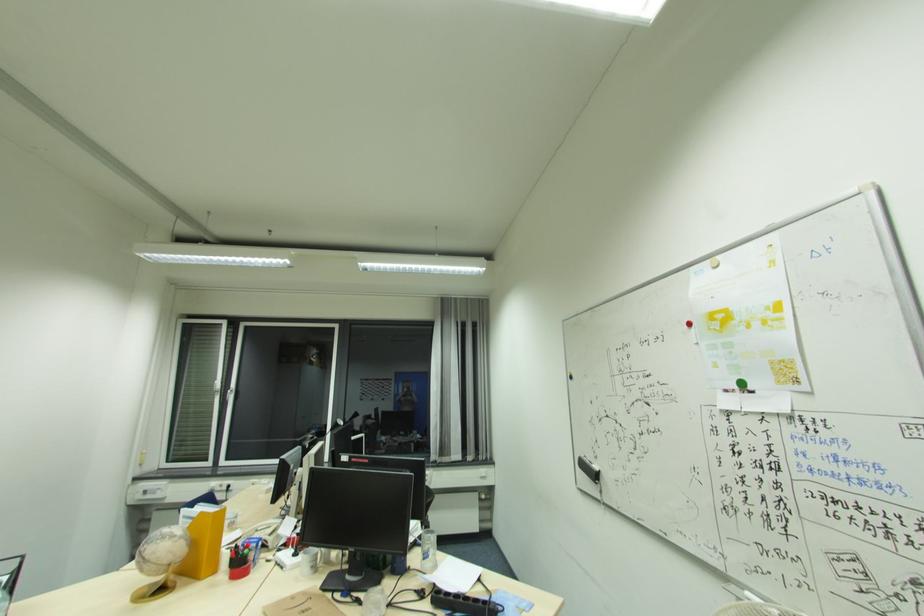
Identify the location of white mug. The image size is (924, 616). (309, 561).